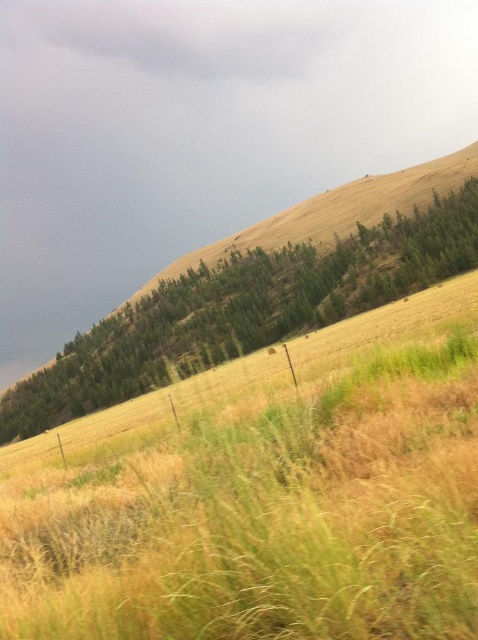
Can you confirm if dry grass at upper center is thinner than green leafy tree at upper center?

Yes, dry grass at upper center is thinner than green leafy tree at upper center.

Does dry grass at upper center appear over green leafy tree at upper center?

No.

Which is in front, point (177, 426) or point (454, 200)?

Point (177, 426)

This screenshot has height=640, width=478. In order to click on dry grass at upper center in this screenshot , I will do `click(263, 496)`.